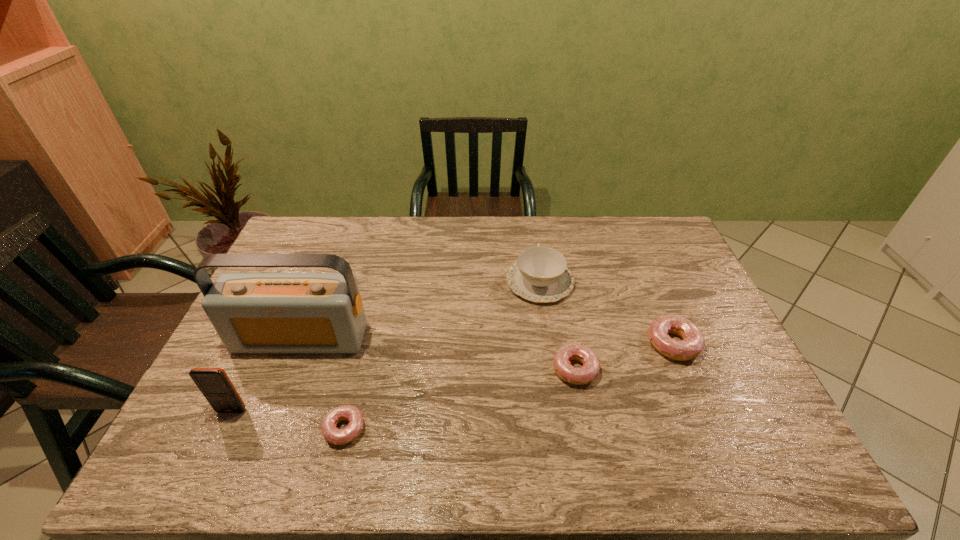
You are a GUI agent. You are given a task and a screenshot of the screen. Output one action in this format:
    pyautogui.click(x=<x>, y=<y>)
    Task: Click on the free spot between the shortest doughnut and the tallest object
    
    Given the screenshot: What is the action you would take?
    click(x=323, y=384)

Find the location of a particular element. The width and height of the screenshot is (960, 540). free spot between the tallest doughnut and the third tallest object is located at coordinates (607, 313).

In order to click on blank region between the second tallest doughnut and the cellular telephone in this screenshot , I will do `click(403, 390)`.

This screenshot has width=960, height=540. Find the location of `vacant space that is in between the second shortest object and the rightmost object`. vacant space that is in between the second shortest object and the rightmost object is located at coordinates (624, 357).

Locate an element on the screen. unoccupied area between the nearest doughnut and the tallest doughnut is located at coordinates (509, 387).

Identify the location of vacant region between the leftmost doughnut and the radio receiver. Image resolution: width=960 pixels, height=540 pixels. (323, 384).

The width and height of the screenshot is (960, 540). What are the coordinates of `vacant area that lies between the chinaware and the shortest object` in the screenshot? It's located at (443, 356).

You are a GUI agent. You are given a task and a screenshot of the screen. Output one action in this format:
    pyautogui.click(x=<x>, y=<y>)
    Task: Click on the free space between the fifth tallest object and the third shortest object
    
    Given the screenshot: What is the action you would take?
    pyautogui.click(x=624, y=357)

Identify which object is located as the third nearest to the cellular telephone. Please provide its 2D coordinates. Your answer should be formatted as a tuple, i.e. [(x, y)], where the tuple contains the x and y coordinates of a point satisfying the conditions above.

[(540, 274)]

Identify which object is the fifth nearest to the cellular telephone. Please provide its 2D coordinates. Your answer should be formatted as a tuple, i.e. [(x, y)], where the tuple contains the x and y coordinates of a point satisfying the conditions above.

[(693, 342)]